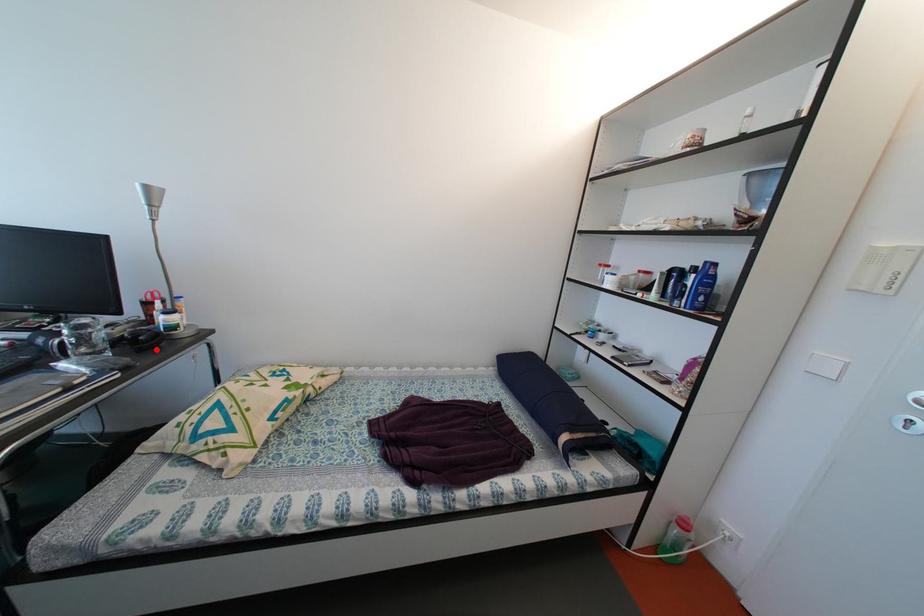
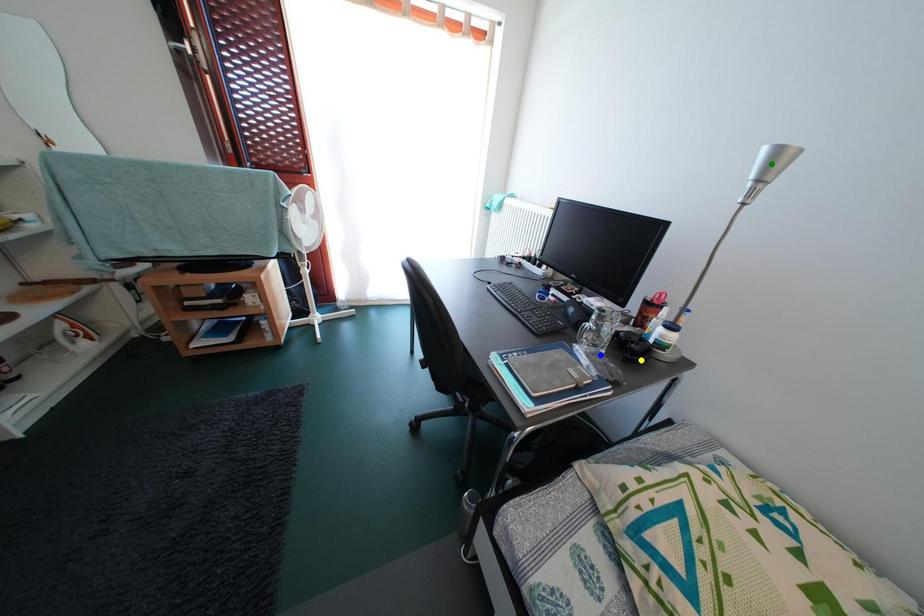
Question: I am providing you with two images of the same scene from different viewpoints. A red point is marked on the first image. You are given multiple points on the second image. In image 2, which mark is for the same physical point as the one in image 1?

Choices:
 (A) green point
 (B) yellow point
 (C) blue point

Answer: (B)